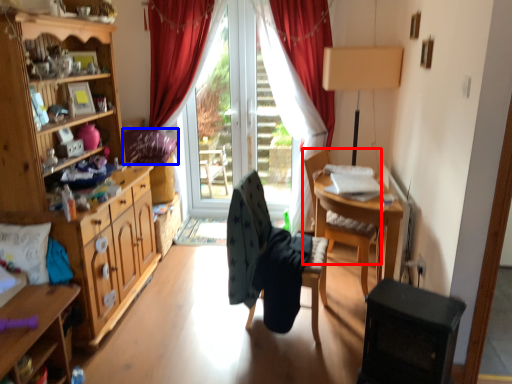
Question: Which object is further to the camera taking this photo, chair (highlighted by a red box) or pillow (highlighted by a blue box)?

Choices:
 (A) chair
 (B) pillow

Answer: (B)